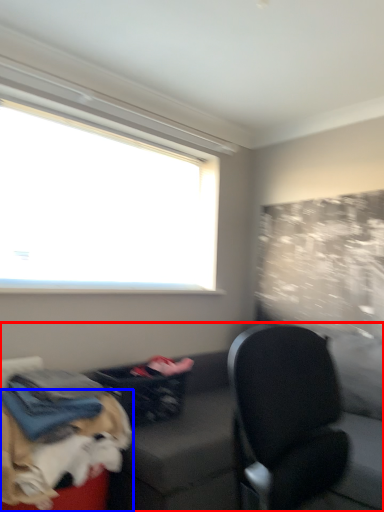
Question: Which object appears farthest to the camera in this image, studio couch (highlighted by a red box) or dog (highlighted by a blue box)?

Choices:
 (A) studio couch
 (B) dog

Answer: (A)